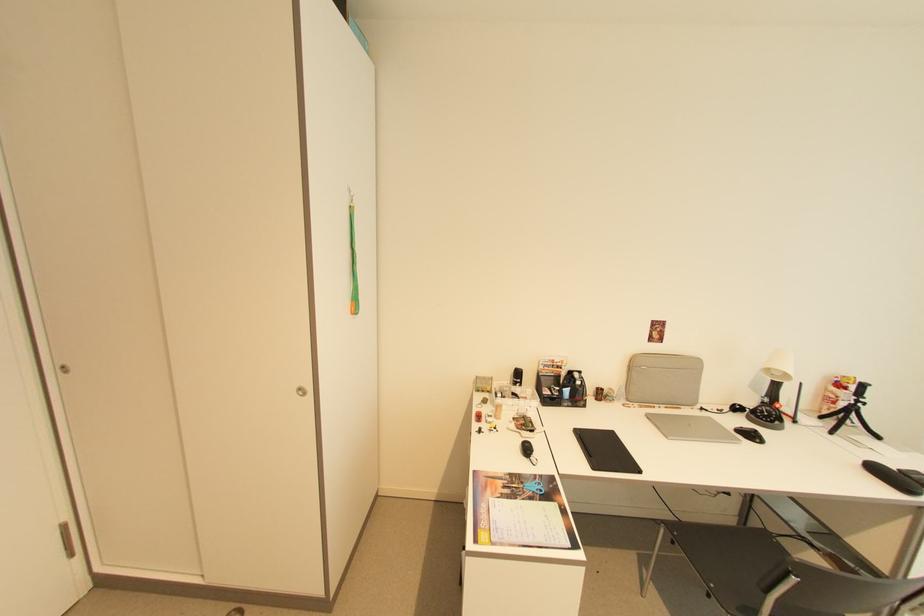
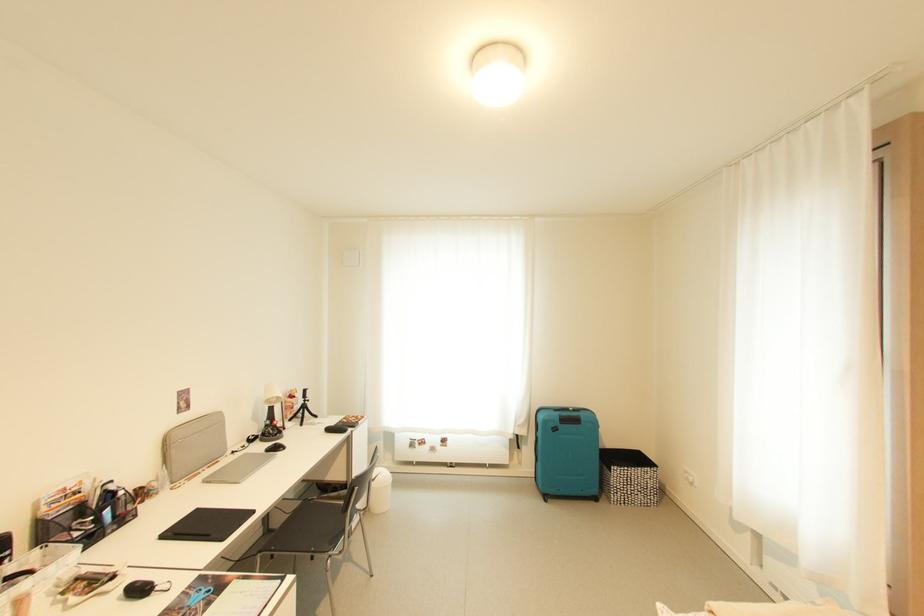
In the second image, find the point that corresponds to point (839, 405) in the first image.

(297, 410)